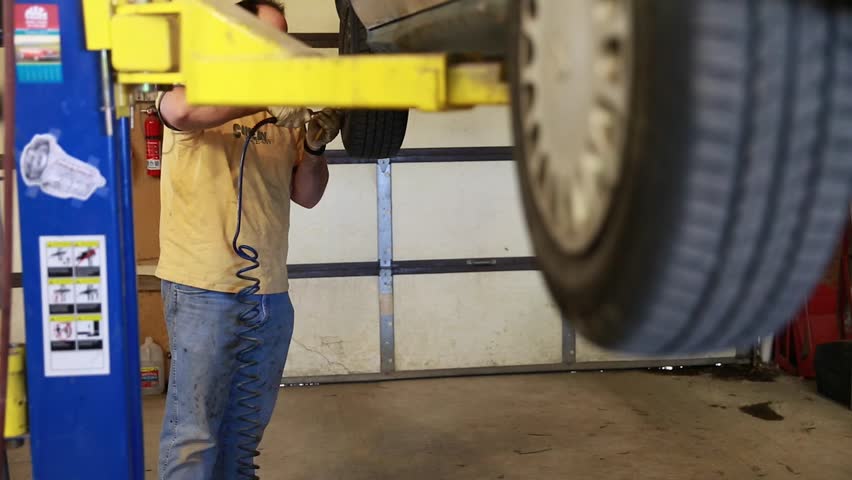
Locate an element on the screen. bucket is located at coordinates (18, 408).